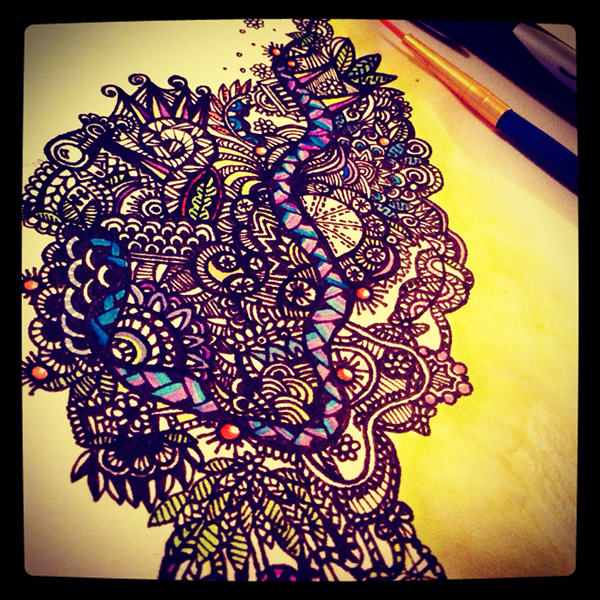
You are a GUI agent. You are given a task and a screenshot of the screen. Output one action in this format:
    pyautogui.click(x=<x>, y=<y>)
    Task: Click on the blue handle of brush
    Image resolution: width=600 pixels, height=600 pixels.
    Given the screenshot: What is the action you would take?
    pyautogui.click(x=551, y=149)